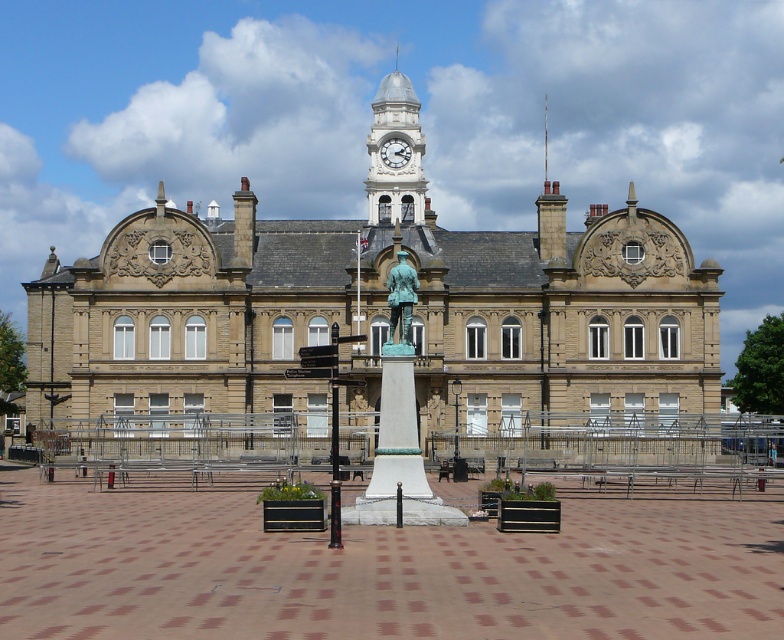
Question: Is beige stone building at center thinner than brick paving at center?

Choices:
 (A) no
 (B) yes

Answer: (A)

Question: Can you confirm if beige stone building at center is positioned to the right of white stone clock tower at upper center?

Choices:
 (A) no
 (B) yes

Answer: (A)

Question: Which object is closer to the camera taking this photo?

Choices:
 (A) brick paving at center
 (B) bronze statue at center
 (C) white stone clock at upper center
 (D) white stone clock tower at upper center

Answer: (A)

Question: Does white stone clock tower at upper center have a lesser width compared to bronze statue at center?

Choices:
 (A) no
 (B) yes

Answer: (A)

Question: Which is nearer to the brick paving at center?

Choices:
 (A) bronze statue at center
 (B) white stone clock tower at upper center
 (C) white stone clock at upper center
 (D) beige stone building at center

Answer: (D)

Question: Which point is farther to the camera?

Choices:
 (A) brick paving at center
 (B) bronze statue at center
 (C) white stone clock at upper center
 (D) beige stone building at center

Answer: (C)